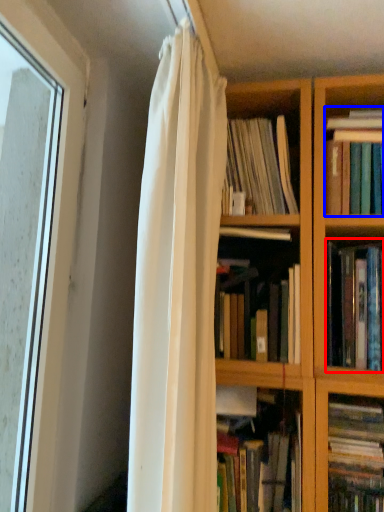
Question: Which object appears closest to the camera in this image, book (highlighted by a red box) or book (highlighted by a blue box)?

Choices:
 (A) book
 (B) book

Answer: (A)